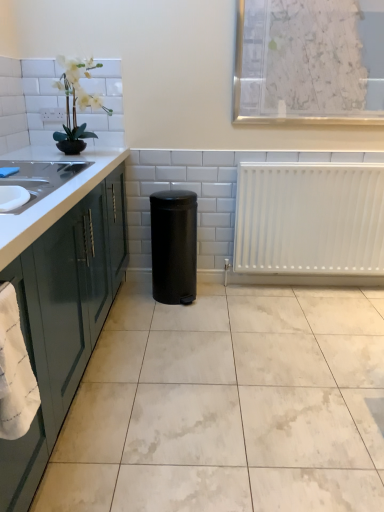
Locate an element on the screen. unoccupied region to the right of black matte trash can at center is located at coordinates (225, 298).